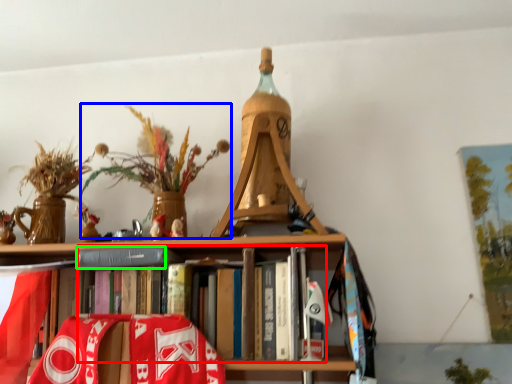
Question: Based on their relative distances, which object is nearer to book (highlighted by a red box)? Choose from floral arrangement (highlighted by a blue box) and paperback book (highlighted by a green box).

Choices:
 (A) floral arrangement
 (B) paperback book

Answer: (B)